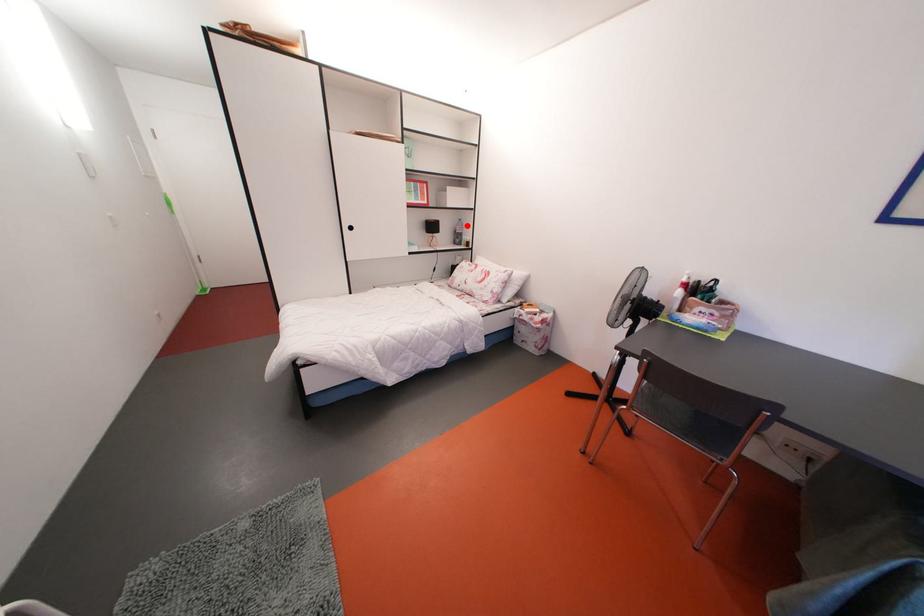
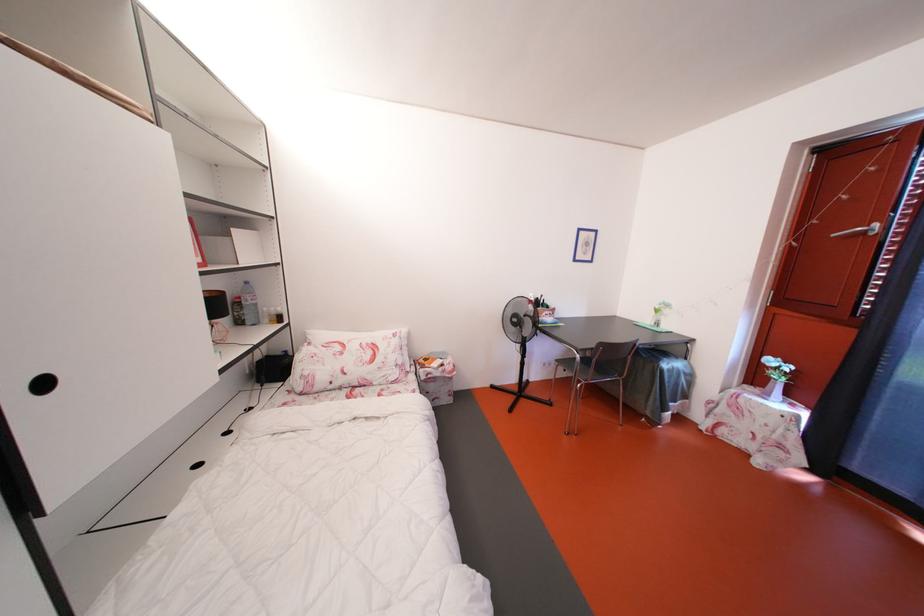
In the second image, find the point that corresponds to the highlighted location in the first image.

(253, 288)